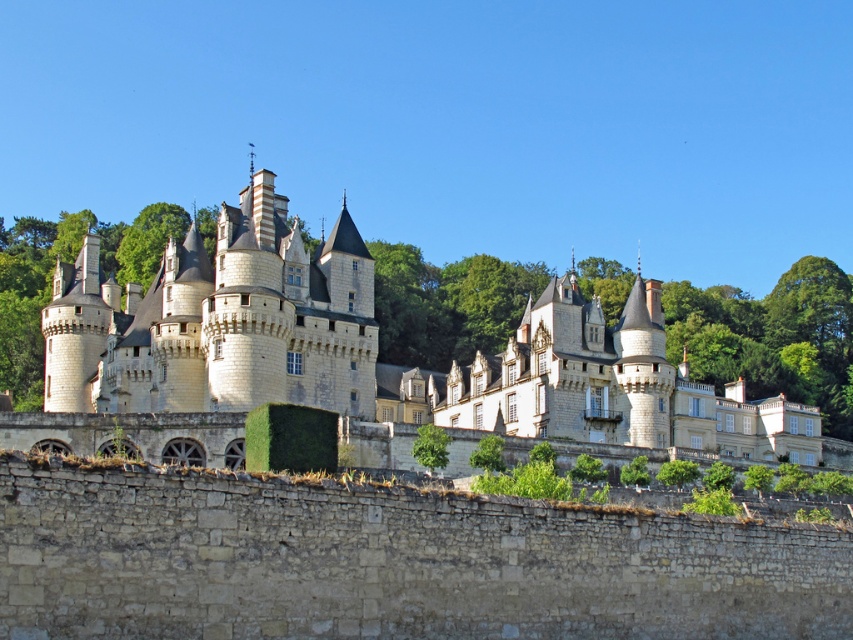
Does white stone castle at center appear on the right side of gray stone wall at lower center?

Yes, white stone castle at center is to the right of gray stone wall at lower center.

Is white stone castle at center to the left of gray stone wall at lower center from the viewer's perspective?

No, white stone castle at center is not to the left of gray stone wall at lower center.

Does point (231, 307) come farther from viewer compared to point (107, 518)?

That is True.

This screenshot has width=853, height=640. Find the location of `white stone castle at center`. white stone castle at center is located at coordinates (451, 337).